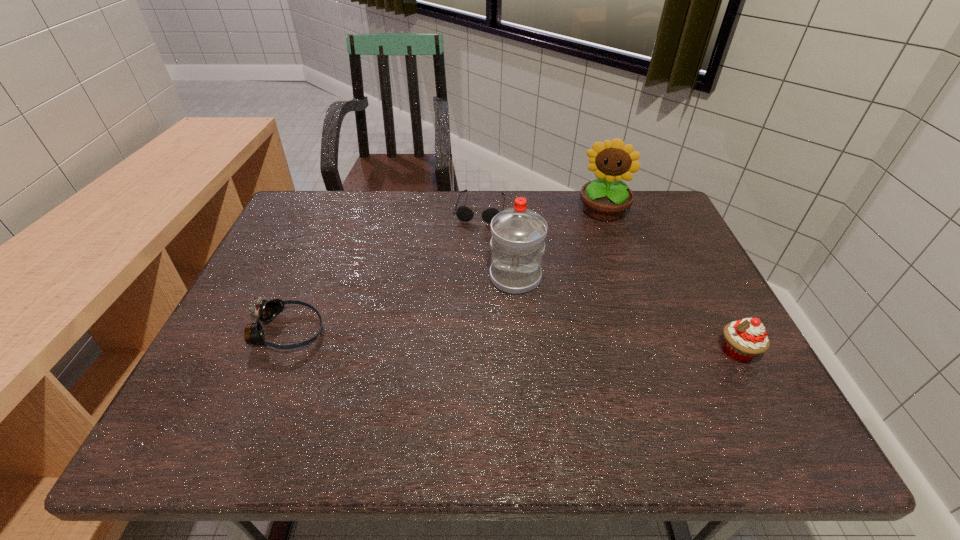
This screenshot has width=960, height=540. I want to click on blank space at the far right corner of the desktop, so click(662, 227).

Find the location of a particular element. This screenshot has height=540, width=960. free space that is in between the sunflower and the sunglasses is located at coordinates (541, 210).

Locate an element on the screen. The image size is (960, 540). vacant area that lies between the sunglasses and the sunflower is located at coordinates click(x=541, y=210).

Identify the location of vacant area that lies between the goggles and the rightmost object. (512, 342).

Where is `empty location between the sunflower and the shortest object`? The image size is (960, 540). empty location between the sunflower and the shortest object is located at coordinates (541, 210).

Image resolution: width=960 pixels, height=540 pixels. What are the coordinates of `vacant space that's between the shortest object and the goggles` in the screenshot? It's located at (384, 269).

This screenshot has width=960, height=540. In order to click on empty location between the second object from right to left and the leftmost object in this screenshot , I will do `click(445, 271)`.

This screenshot has width=960, height=540. What are the coordinates of `free space that is in between the third nearest object and the rightmost object` in the screenshot? It's located at (626, 315).

The image size is (960, 540). What are the coordinates of `free space between the sunflower and the third shortest object` in the screenshot? It's located at (670, 282).

The image size is (960, 540). I want to click on object that is the second closest to the fourth object from left to right, so click(x=463, y=213).